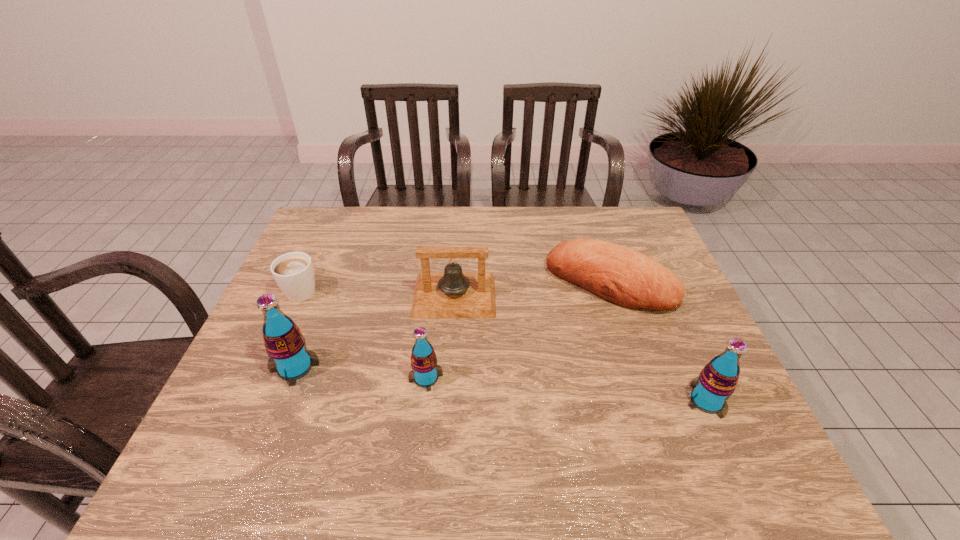
Image resolution: width=960 pixels, height=540 pixels. I want to click on object situated at the near right corner, so click(717, 381).

In the image, there is a desktop. Where is `vacant region at the far edge`? vacant region at the far edge is located at coordinates (564, 206).

This screenshot has height=540, width=960. In order to click on free space at the near edge in this screenshot , I will do `click(530, 401)`.

Where is `vacant space at the far right corner of the desktop`? This screenshot has height=540, width=960. vacant space at the far right corner of the desktop is located at coordinates (620, 219).

At what (x,y) coordinates should I click in order to perform the action: click on vacant space in between the bread and the second soda from left to right. Please return your answer as a coordinate pair (x, y). This screenshot has height=540, width=960. Looking at the image, I should click on (517, 330).

Image resolution: width=960 pixels, height=540 pixels. Identify the location of free spot between the leftmost soda and the cappuccino. (299, 328).

Locate an element on the screen. vacant area that lies between the rightmost soda and the bread is located at coordinates coord(659,342).

Where is `free point between the rightmost soda and the bread`? The width and height of the screenshot is (960, 540). free point between the rightmost soda and the bread is located at coordinates (659, 342).

Locate an element on the screen. The image size is (960, 540). vacant region between the second soda from left to right and the leftmost soda is located at coordinates (361, 372).

Find the location of a particular element. blank region between the bell and the rightmost soda is located at coordinates (581, 348).